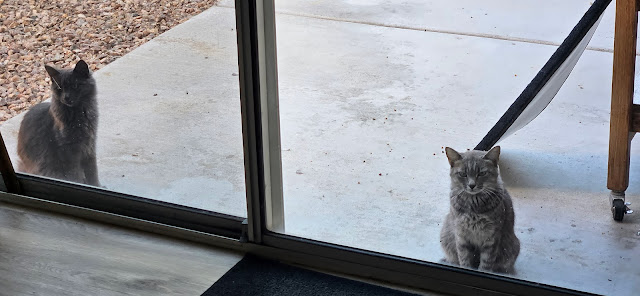
At what (x,y) coordinates should I click in order to perform the action: click on floor. Please return your answer as a coordinate pair (x, y). The height and width of the screenshot is (296, 640). Looking at the image, I should click on (84, 262), (178, 121), (388, 112), (566, 153).